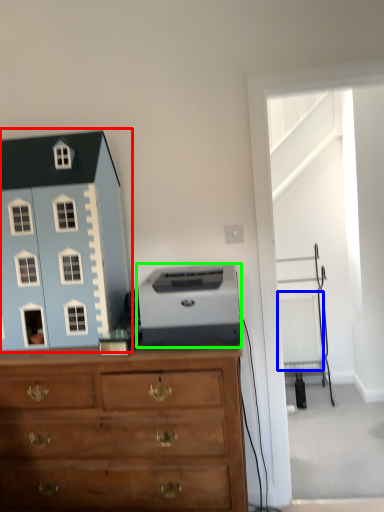
Question: Which object is the farthest from toy (highlighted by a red box)? Choose among these: radiator (highlighted by a blue box) or printer (highlighted by a green box).

Choices:
 (A) radiator
 (B) printer

Answer: (A)